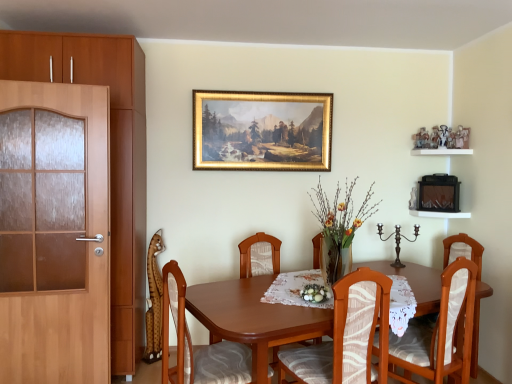
Question: Based on their positions, is wooden chair with white cushion at center, the 4th chair in the left-to-right sequence, located to the left or right of wooden chair with patterned cushion at center, marked as the 3th chair in a left-to-right arrangement?

Choices:
 (A) right
 (B) left

Answer: (A)

Question: Considering their positions, is wooden chair with white cushion at center, the first chair when ordered from right to left, located in front of or behind wooden chair with patterned cushion at center, marked as the 3th chair in a left-to-right arrangement?

Choices:
 (A) front
 (B) behind

Answer: (B)

Question: Which object is positioned closest to the translucent glass vase at center, the second floral arrangement in the bottom-to-top sequence?

Choices:
 (A) wooden chair with white cushion at center, the 4th chair in the left-to-right sequence
 (B) white lace tablecloth at center
 (C) wooden chair with patterned cushion at center, placed as the 2th chair when sorted from right to left
 (D) wooden chair with patterned cushion at center, placed as the fourth chair when sorted from right to left
 (E) wooden chair with patterned cushion at center, the 3th chair in the right-to-left sequence

Answer: (B)

Question: Which is nearer to the white fabric floral arrangement at center, the 1th floral arrangement in the bottom-to-top sequence?

Choices:
 (A) wooden chair with patterned cushion at center, the 3th chair in the right-to-left sequence
 (B) wooden chair with white cushion at center, the first chair when ordered from right to left
 (C) translucent glass vase at center, the second floral arrangement in the bottom-to-top sequence
 (D) wooden chair with patterned cushion at center, placed as the 2th chair when sorted from right to left
 (E) white lace tablecloth at center

Answer: (E)